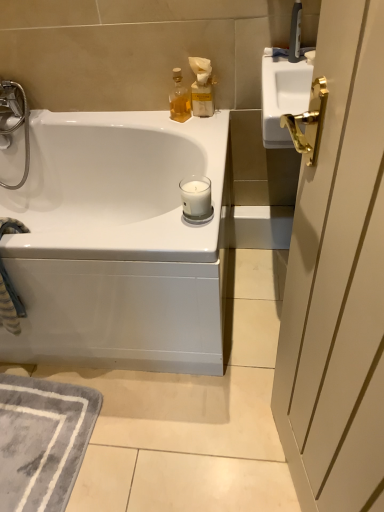
Question: In terms of height, does white glossy bathtub at upper left look taller or shorter compared to translucent glass bottle at upper center?

Choices:
 (A) tall
 (B) short

Answer: (A)

Question: Relative to translucent glass bottle at upper center, is white glossy bathtub at upper left in front or behind?

Choices:
 (A) behind
 (B) front

Answer: (B)

Question: Estimate the real-world distances between objects in this image. Which object is farther from the white glass candle at center?

Choices:
 (A) white glossy bathtub at upper left
 (B) matte beige bottle at upper right
 (C) translucent glass bottle at upper center
 (D) gray soft rug at lower left

Answer: (D)

Question: Based on their relative distances, which object is nearer to the gray soft rug at lower left?

Choices:
 (A) matte beige bottle at upper right
 (B) translucent glass bottle at upper center
 (C) white glossy bathtub at upper left
 (D) white glass candle at center

Answer: (C)